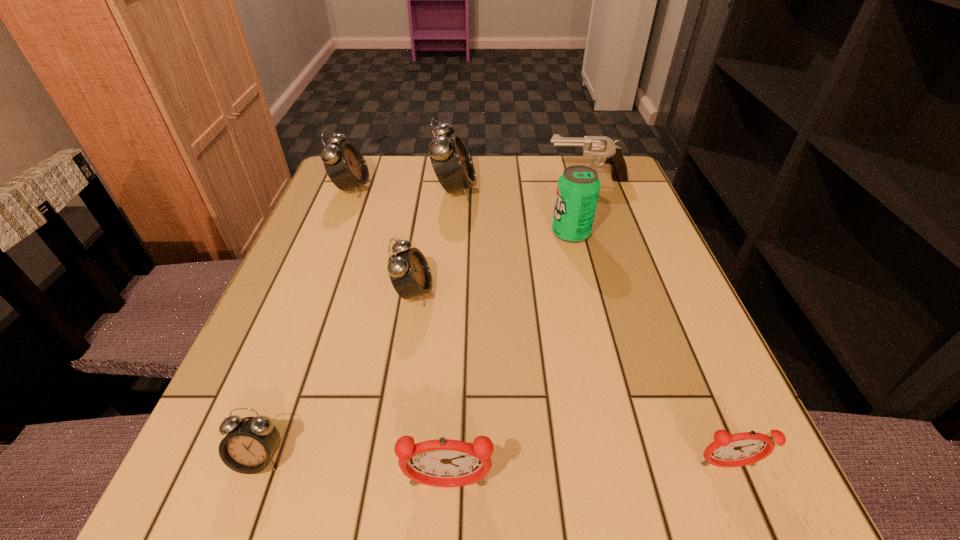
Locate an element on the screen. vacant space located on the face of the third farthest alarm clock is located at coordinates (496, 293).

Find the location of a particular element. vacant area situated 0.060m on the front-facing side of the rightmost alarm clock is located at coordinates (750, 522).

This screenshot has width=960, height=540. I want to click on gun situated at the far edge, so click(x=601, y=146).

Identify the location of pop soda at the right edge. This screenshot has height=540, width=960. (578, 187).

What are the coordinates of `gun that is at the right edge` in the screenshot? It's located at (601, 146).

You are a GUI agent. You are given a task and a screenshot of the screen. Output one action in this format:
    pyautogui.click(x=<x>, y=<y>)
    Task: Click on the alarm clock at the right edge
    This screenshot has width=960, height=540.
    Given the screenshot: What is the action you would take?
    pyautogui.click(x=740, y=449)

The image size is (960, 540). I want to click on object that is at the far left corner, so click(345, 165).

In order to click on object situated at the near left corner in this screenshot , I will do `click(250, 443)`.

Identify the location of object located at the far right corner. (601, 146).

Locate an element on the screen. This screenshot has width=960, height=540. object situated at the near right corner is located at coordinates (740, 449).